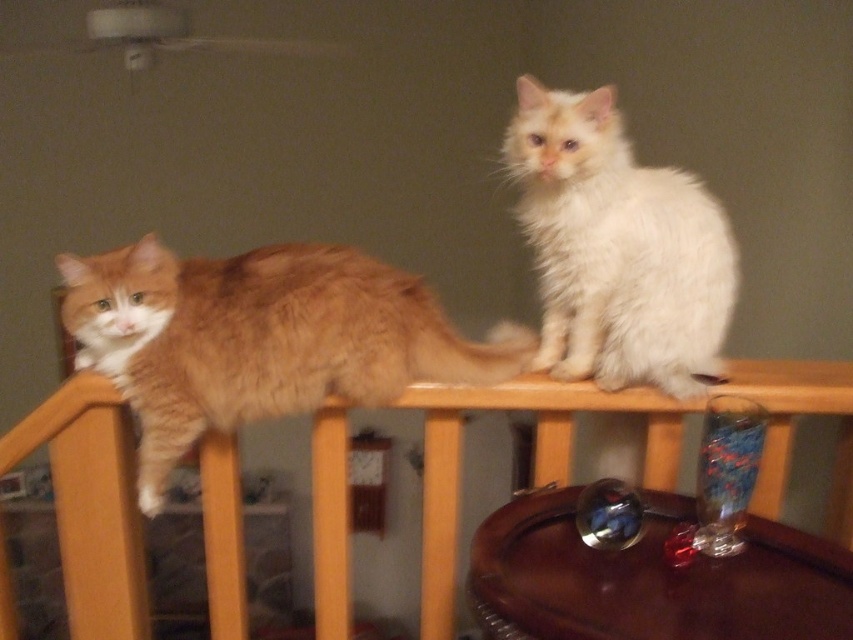
Question: Is orange fluffy cat at upper left to the left of transparent glass at lower right from the viewer's perspective?

Choices:
 (A) no
 (B) yes

Answer: (B)

Question: Which object is the closest to the wooden balustrade at upper center?

Choices:
 (A) orange fluffy cat at upper left
 (B) white fluffy cat at upper right
 (C) transparent glass at lower right

Answer: (A)

Question: Among these points, which one is nearest to the camera?

Choices:
 (A) (341, 600)
 (B) (395, 282)

Answer: (B)

Question: Considering the relative positions of wooden balustrade at upper center and white fluffy cat at upper right in the image provided, where is wooden balustrade at upper center located with respect to white fluffy cat at upper right?

Choices:
 (A) above
 (B) below

Answer: (B)

Question: Observing the image, what is the correct spatial positioning of white fluffy cat at upper right in reference to transparent glass at lower right?

Choices:
 (A) right
 (B) left

Answer: (B)

Question: Which object is closer to the camera taking this photo?

Choices:
 (A) orange fluffy cat at upper left
 (B) wooden balustrade at upper center

Answer: (A)